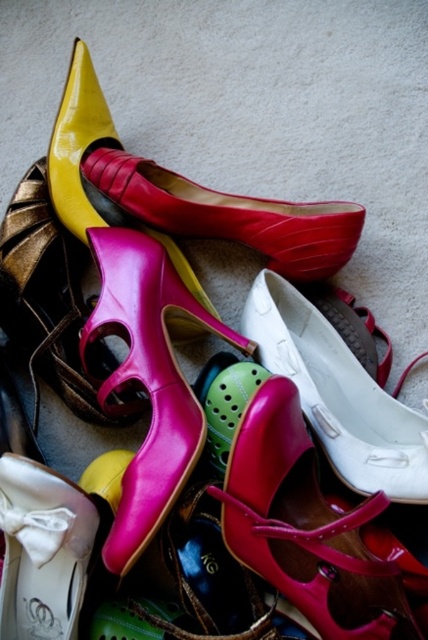
Between point (56, 253) and point (27, 467), which one is positioned behind?

The point (56, 253) is behind.

Between pink leather high-heeled shoe at center and white satin shoe at lower left, which one has more height?

pink leather high-heeled shoe at center is taller.

Image resolution: width=428 pixels, height=640 pixels. Describe the element at coordinates (47, 292) in the screenshot. I see `pink leather high-heeled shoe at center` at that location.

Find the location of `pink leather high-heeled shoe at center`. pink leather high-heeled shoe at center is located at coordinates (47, 292).

Based on the photo, is shiny pink sandal at center positioned in front of white matte shoe at center?

Yes, shiny pink sandal at center is closer to the viewer.

Can you confirm if shiny pink sandal at center is wider than white matte shoe at center?

No.

Is point (177, 442) positioned behind point (252, 296)?

No, it is in front of (252, 296).

This screenshot has width=428, height=640. Identify the location of shiny pink sandal at center. (146, 380).

Which is above, white matte shoe at center or pink leather high-heeled shoe at center?

pink leather high-heeled shoe at center

I want to click on white matte shoe at center, so click(338, 394).

This screenshot has height=640, width=428. Describe the element at coordinates (338, 394) in the screenshot. I see `white matte shoe at center` at that location.

This screenshot has height=640, width=428. I want to click on white matte shoe at center, so click(x=338, y=394).